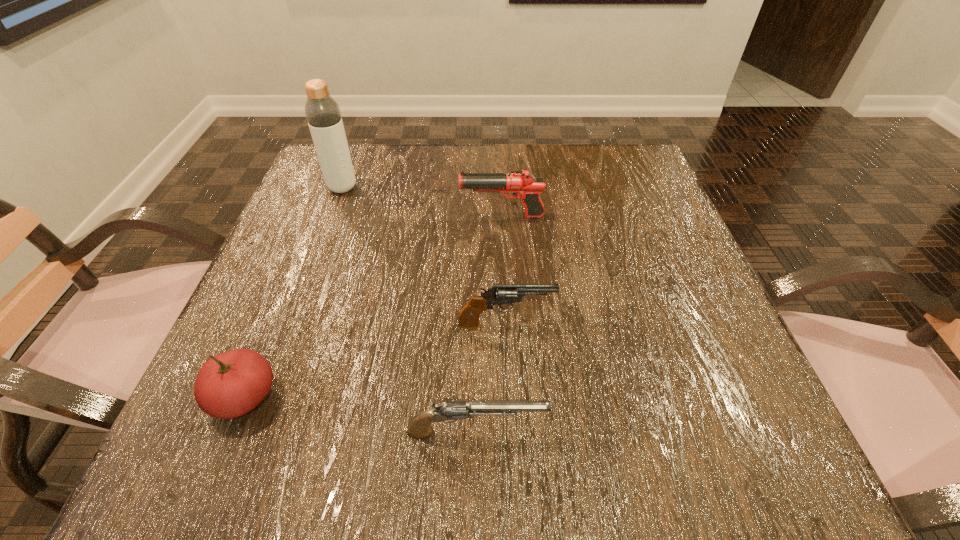
Where is `free region that satisfies the following two spatial constraints: 1. along the barrel of the third nearest object; 2. on the front side of the tomato`? This screenshot has width=960, height=540. free region that satisfies the following two spatial constraints: 1. along the barrel of the third nearest object; 2. on the front side of the tomato is located at coordinates (509, 397).